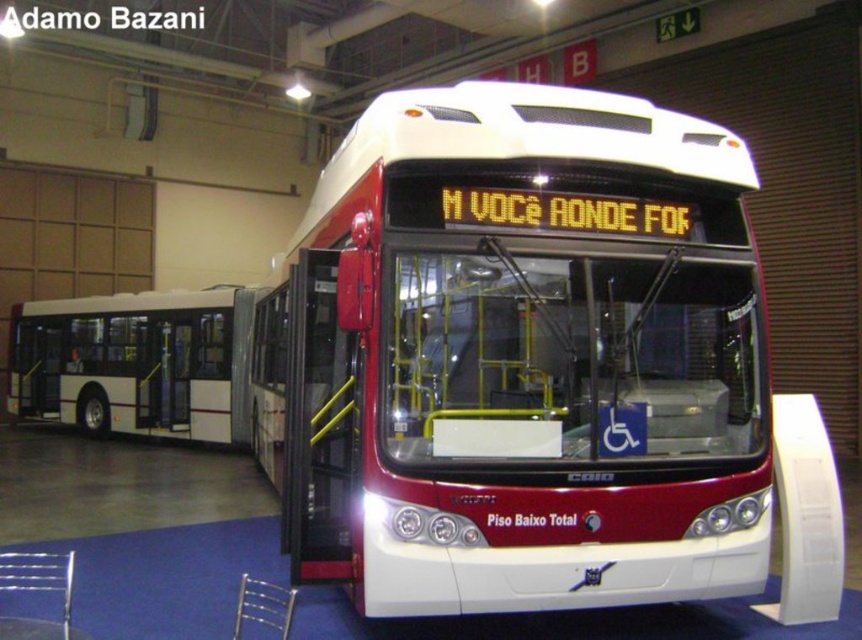
You are standing at the entrance of the transport exhibition hall and see the point marked at coordinate [523,356]. What object does this point indicate?

The point marked at coordinate [523,356] indicates the matte white bus at center.

You are standing in a transport exhibition and see two buses, the matte white bus at center and the white matte bus at left. Which one is nearer to you?

The matte white bus at center is closer to the viewer than the white matte bus at left, so the matte white bus at center is nearer to you.

Looking at this image, you are an event planner organizing a transport exhibition. You need to place two buses in a row in a narrow corridor. The corridor is only wide enough for a bus that is 2.5 meters wide. The matte white bus at center and the white matte bus at left are available. Which bus should you choose to fit in the corridor?

The matte white bus at center has a width less than the white matte bus at left, so the matte white bus at center would fit in the 2.5 meter wide corridor better than the white matte bus at left.